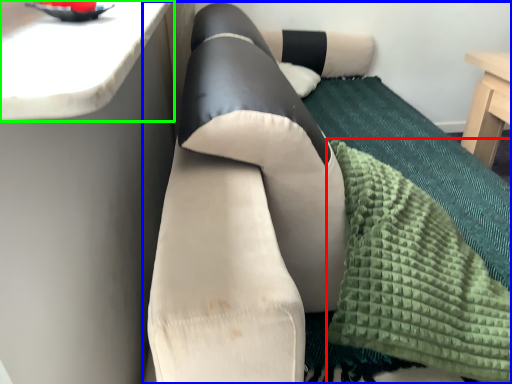
Question: Which object is the farthest from blanket (highlighted by a red box)? Choose among these: studio couch (highlighted by a blue box) or counter top (highlighted by a green box).

Choices:
 (A) studio couch
 (B) counter top

Answer: (B)